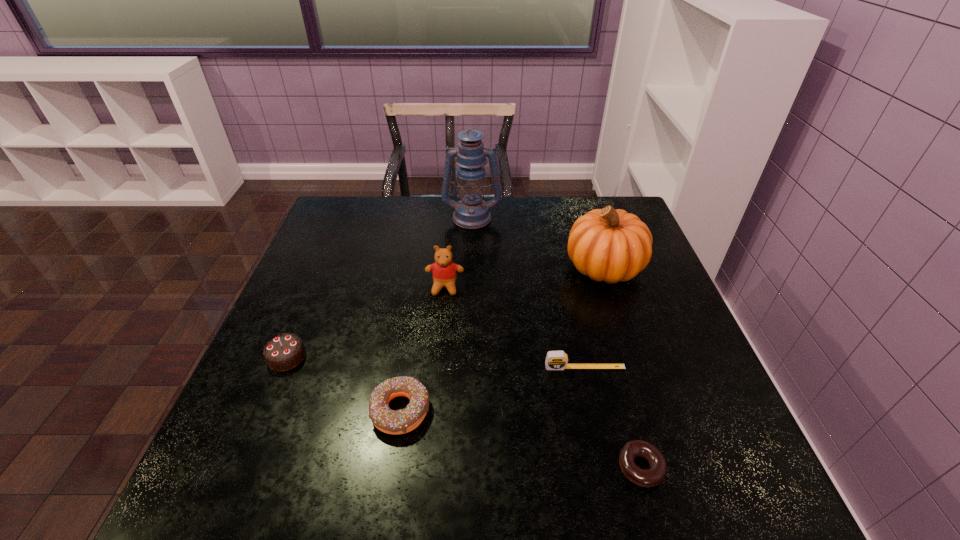
At what (x,y) coordinates should I click in order to perform the action: click on object positioned at the left edge. Please return your answer as a coordinate pair (x, y). Looking at the image, I should click on (284, 352).

Find the location of a particular element. The height and width of the screenshot is (540, 960). pumpkin present at the right edge is located at coordinates (609, 245).

At what (x,y) coordinates should I click in order to perform the action: click on doughnut at the right edge. Please return your answer as a coordinate pair (x, y). Image resolution: width=960 pixels, height=540 pixels. Looking at the image, I should click on (654, 475).

At what (x,y) coordinates should I click in order to perform the action: click on object located in the near right corner section of the desktop. Please return your answer as a coordinate pair (x, y). This screenshot has width=960, height=540. Looking at the image, I should click on (654, 475).

In the image, there is a desktop. Where is `vacant space at the far edge`? vacant space at the far edge is located at coordinates (522, 204).

In the image, there is a desktop. Where is `free region at the near edge`? free region at the near edge is located at coordinates (515, 511).

At what (x,y) coordinates should I click in order to perform the action: click on vacant space at the left edge of the desktop. Please return your answer as a coordinate pair (x, y). Looking at the image, I should click on (301, 369).

You are a GUI agent. You are given a task and a screenshot of the screen. Output one action in this format:
    pyautogui.click(x=<x>, y=<y>)
    Task: Click on the free space at the right edge
    
    Given the screenshot: What is the action you would take?
    [x=682, y=406]

In the image, there is a desktop. Identify the location of vacant space at the far left corner. The height and width of the screenshot is (540, 960). (326, 218).

Where is `blank area at the near left corner`? blank area at the near left corner is located at coordinates (227, 510).